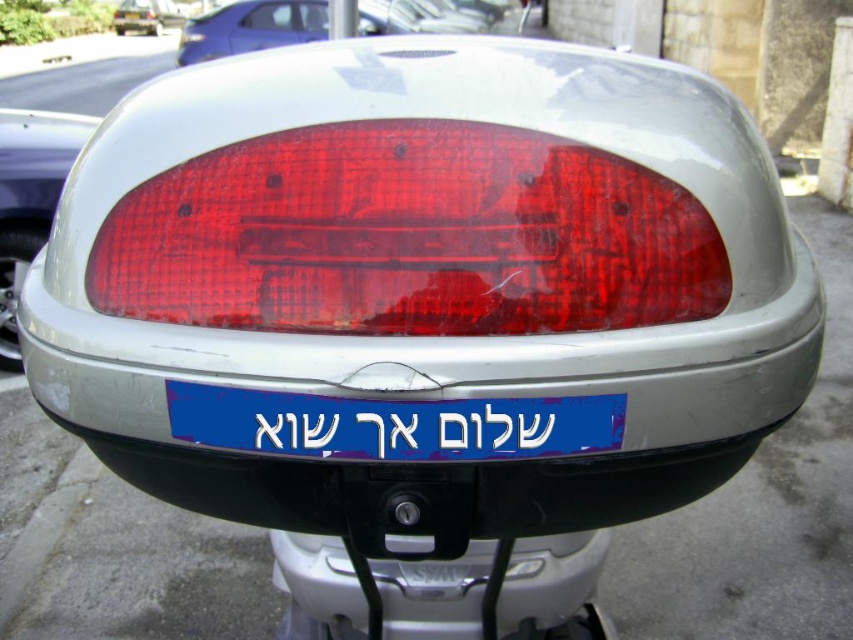
Does metallic silver bumper at lower center lie behind matte red taillight at upper center?

No, it is in front of matte red taillight at upper center.

Does point (329, 600) come closer to viewer compared to point (325, 24)?

Yes, point (329, 600) is closer to viewer.

Identify the location of metallic silver bumper at lower center. The image size is (853, 640). (498, 592).

Does metallic silver bumper at lower center have a greater height compared to matte plastic tail light at left?

In fact, metallic silver bumper at lower center may be shorter than matte plastic tail light at left.

How much distance is there between metallic silver bumper at lower center and matte plastic tail light at left?

metallic silver bumper at lower center and matte plastic tail light at left are 3.13 meters apart from each other.

You are a GUI agent. You are given a task and a screenshot of the screen. Output one action in this format:
    pyautogui.click(x=<x>, y=<y>)
    Task: Click on the metallic silver bumper at lower center
    The image size is (853, 640).
    Given the screenshot: What is the action you would take?
    tap(498, 592)

What do you see at coordinates (409, 236) in the screenshot? I see `transparent red tail light at center` at bounding box center [409, 236].

Locate an element on the screen. The height and width of the screenshot is (640, 853). transparent red tail light at center is located at coordinates (409, 236).